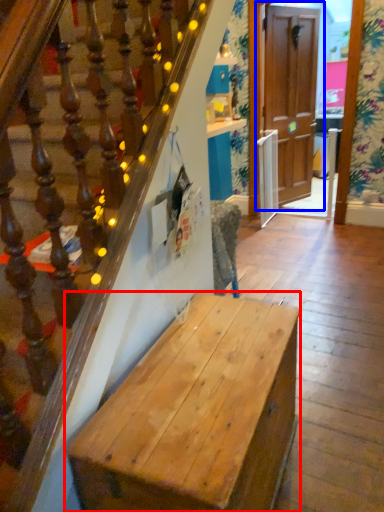
Question: Which object appears closest to the camera in this image, desk (highlighted by a red box) or door (highlighted by a blue box)?

Choices:
 (A) desk
 (B) door

Answer: (A)